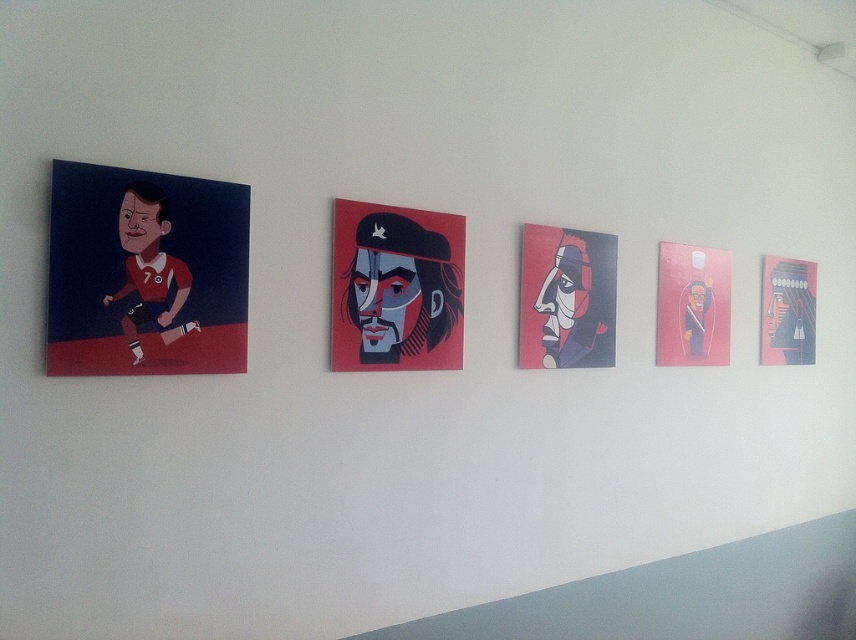
This screenshot has width=856, height=640. Describe the element at coordinates (146, 273) in the screenshot. I see `matte red shirt at left` at that location.

Who is taller, matte red shirt at left or pink matte painting at right?

pink matte painting at right is taller.

What do you see at coordinates (146, 273) in the screenshot?
I see `matte red shirt at left` at bounding box center [146, 273].

At what (x,y) coordinates should I click in order to perform the action: click on matte red shirt at left. Please return your answer as a coordinate pair (x, y). The height and width of the screenshot is (640, 856). Looking at the image, I should click on (146, 273).

Who is taller, matte red shirt at left or matte black mask at center?

With more height is matte red shirt at left.

Does point (64, 355) lie in front of point (602, 289)?

Yes, it is.

Image resolution: width=856 pixels, height=640 pixels. I want to click on matte red shirt at left, so click(x=146, y=273).

Can you confirm if matte red portrait at center is taller than matte black mask at center?

No, matte red portrait at center is not taller than matte black mask at center.

Can you confirm if matte red portrait at center is positioned to the left of matte black mask at center?

Correct, you'll find matte red portrait at center to the left of matte black mask at center.

Between point (331, 291) and point (547, 266), which one is positioned in front?

Point (331, 291) is more forward.

Find the location of a particular element. matte red portrait at center is located at coordinates (396, 289).